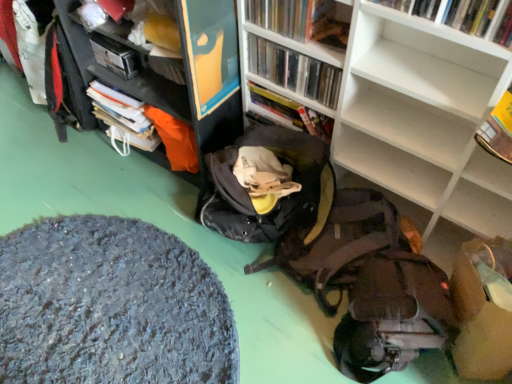
Question: Should I look upward or downward to see hardcover book at upper left?

Choices:
 (A) up
 (B) down

Answer: (A)

Question: Is matte black cabinet at upper left bigger than textured gray rug at lower left?

Choices:
 (A) yes
 (B) no

Answer: (A)

Question: Does matte black cabinet at upper left turn towards textured gray rug at lower left?

Choices:
 (A) yes
 (B) no

Answer: (A)

Question: Is matte black cabinet at upper left completely or partially outside of textured gray rug at lower left?

Choices:
 (A) yes
 (B) no

Answer: (A)

Question: Does matte black cabinet at upper left have a greater height compared to textured gray rug at lower left?

Choices:
 (A) no
 (B) yes

Answer: (B)

Question: Is matte black cabinet at upper left smaller than textured gray rug at lower left?

Choices:
 (A) yes
 (B) no

Answer: (B)

Question: Is matte black cabinet at upper left not near textured gray rug at lower left?

Choices:
 (A) yes
 (B) no

Answer: (B)

Question: Is matte black cabinet at upper left oriented away from matte brown backpack at lower right?

Choices:
 (A) yes
 (B) no

Answer: (B)

Question: Can you confirm if matte black cabinet at upper left is wider than matte brown backpack at lower right?

Choices:
 (A) yes
 (B) no

Answer: (A)

Question: Does matte black cabinet at upper left have a lesser height compared to matte brown backpack at lower right?

Choices:
 (A) no
 (B) yes

Answer: (A)

Question: Is there a large distance between matte black cabinet at upper left and matte brown backpack at lower right?

Choices:
 (A) yes
 (B) no

Answer: (B)

Question: Does matte black cabinet at upper left appear on the right side of matte brown backpack at lower right?

Choices:
 (A) yes
 (B) no

Answer: (B)

Question: Is matte black cabinet at upper left bigger than matte brown backpack at lower right?

Choices:
 (A) yes
 (B) no

Answer: (A)

Question: Considering the relative positions of textured gray rug at lower left and hardcover book at upper right, the 1th book when ordered from front to back, in the image provided, is textured gray rug at lower left to the left of hardcover book at upper right, the 1th book when ordered from front to back, from the viewer's perspective?

Choices:
 (A) yes
 (B) no

Answer: (A)